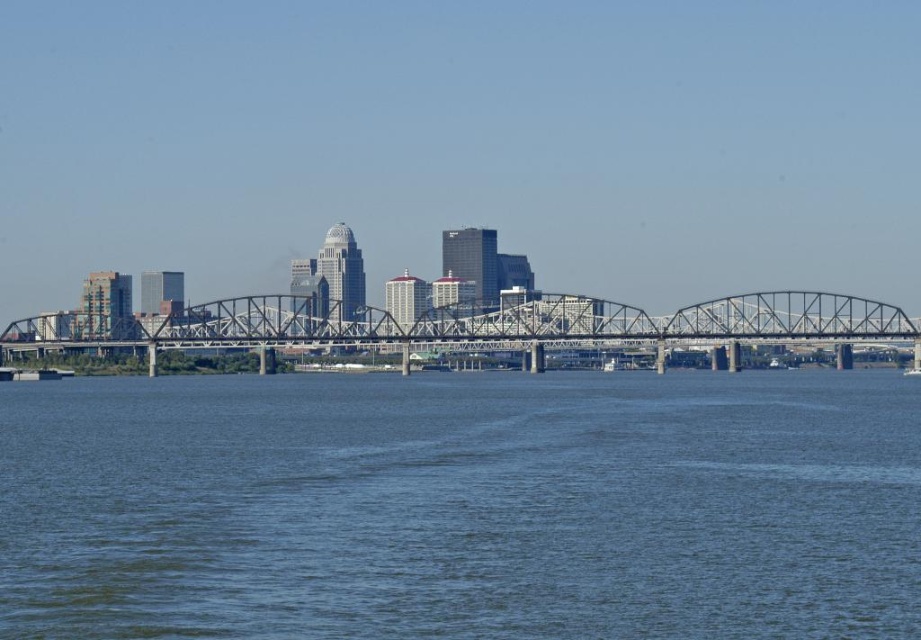
Question: Which point is farther to the camera?

Choices:
 (A) metallic gray bridge at center
 (B) blue water at center

Answer: (A)

Question: Does blue water at center appear on the left side of metallic gray bridge at center?

Choices:
 (A) no
 (B) yes

Answer: (B)

Question: Where is blue water at center located in relation to metallic gray bridge at center in the image?

Choices:
 (A) below
 (B) above

Answer: (A)

Question: Which point is farther to the camera?

Choices:
 (A) (9, 348)
 (B) (758, 630)

Answer: (A)

Question: Which of the following is the farthest from the observer?

Choices:
 (A) blue water at center
 (B) metallic gray bridge at center

Answer: (B)

Question: Does blue water at center appear on the right side of metallic gray bridge at center?

Choices:
 (A) yes
 (B) no

Answer: (B)